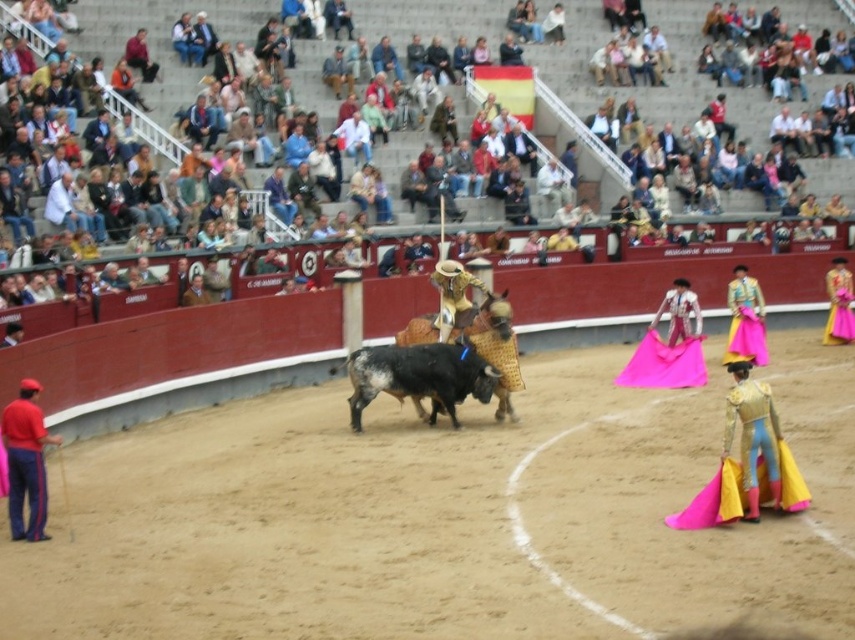
Does black glossy bull at center have a greater height compared to red fabric pants at lower left?

No, black glossy bull at center is not taller than red fabric pants at lower left.

Between black glossy bull at center and red fabric pants at lower left, which one is positioned higher?

black glossy bull at center

Who is more forward, (398, 380) or (13, 516)?

Point (13, 516)

At what (x,y) coordinates should I click in order to perform the action: click on black glossy bull at center. Please return your answer as a coordinate pair (x, y). Looking at the image, I should click on (419, 376).

Can you confirm if multicolored fabric seats at upper center is wider than yellow satin cape at lower right?

Yes.

Which is in front, point (652, 12) or point (728, 340)?

Point (728, 340) is in front.

This screenshot has height=640, width=855. Find the location of `multicolored fabric seats at upper center`. multicolored fabric seats at upper center is located at coordinates (643, 84).

Is point (738, 310) positioned in front of point (828, 320)?

That is True.

Which of these two, yellow satin cape at lower right or yellow satin cape at center, stands taller?

yellow satin cape at lower right is taller.

Between point (747, 324) and point (847, 328), which one is positioned in front?

Point (747, 324) is more forward.

Find the location of a particular element. The width and height of the screenshot is (855, 640). yellow satin cape at lower right is located at coordinates (746, 321).